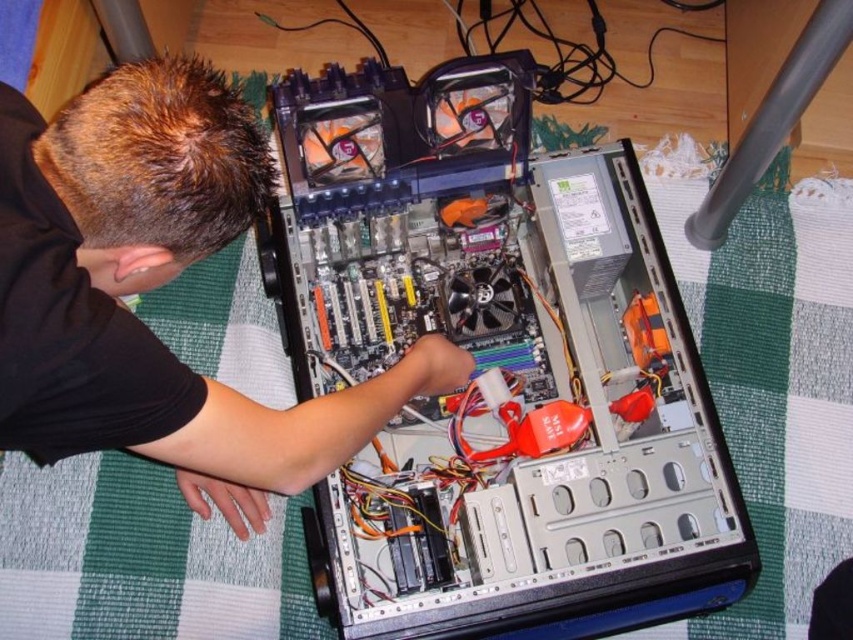
Does silver metallic computer at center have a smaller size compared to black matte shirt at upper left?

No, silver metallic computer at center is not smaller than black matte shirt at upper left.

Which is below, silver metallic computer at center or black matte shirt at upper left?

silver metallic computer at center is below.

Where is `silver metallic computer at center`? The image size is (853, 640). silver metallic computer at center is located at coordinates (496, 369).

Locate an element on the screen. silver metallic computer at center is located at coordinates click(496, 369).